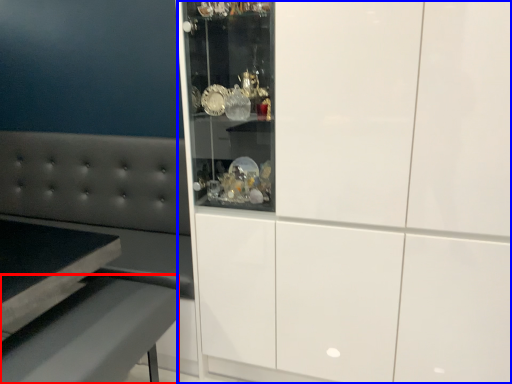
Question: Which point is further to the camera, table (highlighted by a red box) or cabinetry (highlighted by a blue box)?

Choices:
 (A) table
 (B) cabinetry

Answer: (A)